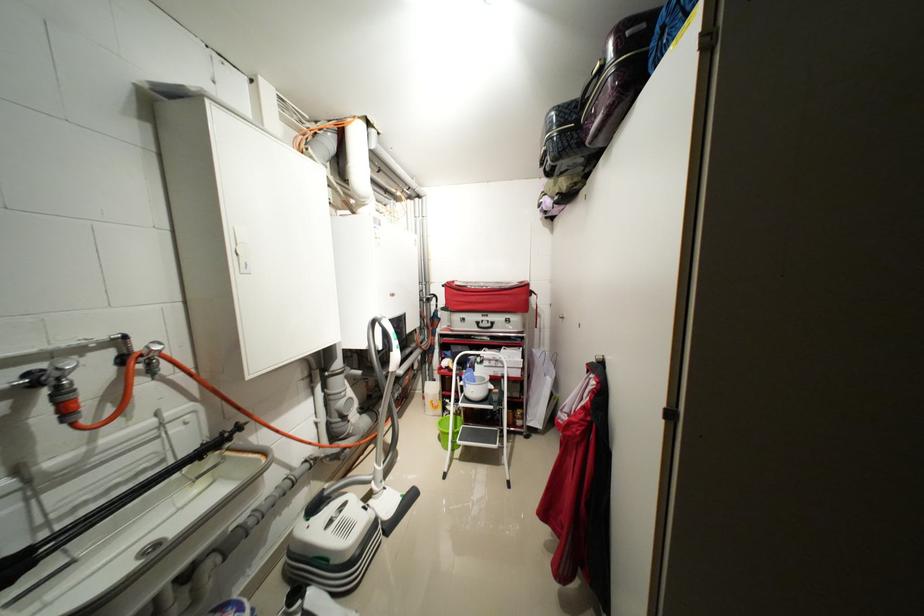
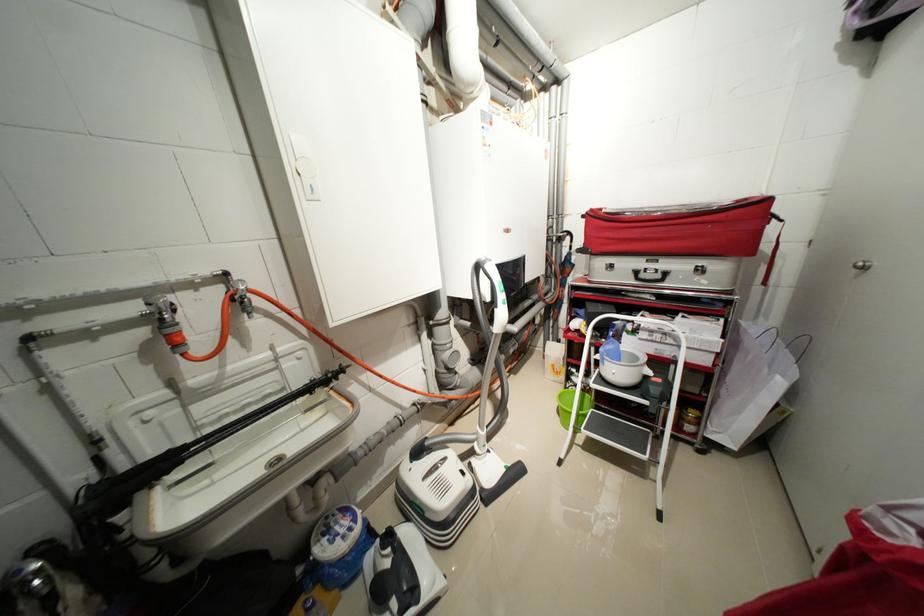
Find the pixel in the second image that matches [555,381] in the first image.

(787, 384)